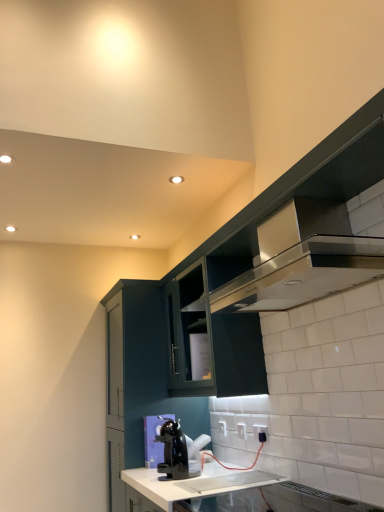
I want to click on matte dark green cabinet at center, positioned as the third cabinetry in right-to-left order, so click(132, 376).

The width and height of the screenshot is (384, 512). What do you see at coordinates (222, 428) in the screenshot?
I see `white plastic electric outlet at lower center, positioned as the third electric outlet in right-to-left order` at bounding box center [222, 428].

Describe the element at coordinates (260, 432) in the screenshot. The width and height of the screenshot is (384, 512). I see `white glossy electric outlet at lower center, the third electric outlet positioned from the back` at that location.

How much space does white glossy electric outlet at lower center, marked as the 1th electric outlet in a right-to-left arrangement, occupy horizontally?

A: The width of white glossy electric outlet at lower center, marked as the 1th electric outlet in a right-to-left arrangement, is 2.35 centimeters.

Measure the distance between white plastic electric outlet at lower center, which ranks as the 2th electric outlet in right-to-left order, and camera.

white plastic electric outlet at lower center, which ranks as the 2th electric outlet in right-to-left order, is 8.06 feet away from camera.

Describe the element at coordinates (212, 335) in the screenshot. Image resolution: width=384 pixels, height=512 pixels. I see `matte dark green cabinet at upper center, which ranks as the second cabinetry in right-to-left order` at that location.

At what (x,y) coordinates should I click in order to perform the action: click on satin silver exhaust hood at upper right. Please return your answer as a coordinate pair (x, y). Looking at the image, I should click on (302, 260).

Measure the distance between satin black cabinet at upper right, which is the third cabinetry in left-to-right order, and white plastic electric outlet at lower center, positioned as the 2th electric outlet in front-to-back order.

satin black cabinet at upper right, which is the third cabinetry in left-to-right order, is 3.75 feet from white plastic electric outlet at lower center, positioned as the 2th electric outlet in front-to-back order.

From the picture: Between satin black cabinet at upper right, which is the third cabinetry in left-to-right order, and white plastic electric outlet at lower center, which is the 2th electric outlet from back to front, which one appears on the right side from the viewer's perspective?

From the viewer's perspective, satin black cabinet at upper right, which is the third cabinetry in left-to-right order, appears more on the right side.

Which of these two, satin black cabinet at upper right, which is the third cabinetry in left-to-right order, or white plastic electric outlet at lower center, which is the 2th electric outlet from back to front, is wider?

satin black cabinet at upper right, which is the third cabinetry in left-to-right order, is wider.

Considering the sizes of objects satin black cabinet at upper right, arranged as the 1th cabinetry when viewed from the right, and white plastic electric outlet at lower center, positioned as the 2th electric outlet in front-to-back order, in the image provided, who is taller, satin black cabinet at upper right, arranged as the 1th cabinetry when viewed from the right, or white plastic electric outlet at lower center, positioned as the 2th electric outlet in front-to-back order,?

satin black cabinet at upper right, arranged as the 1th cabinetry when viewed from the right, is taller.

Is white plastic electric outlet at lower center, positioned as the third electric outlet in right-to-left order, at the right side of white glossy countertop at lower center?

Yes.

Could you measure the distance between white plastic electric outlet at lower center, which appears as the 1th electric outlet when viewed from the left, and white glossy countertop at lower center?

white plastic electric outlet at lower center, which appears as the 1th electric outlet when viewed from the left, and white glossy countertop at lower center are 23.91 inches apart from each other.

In the scene shown: Considering the relative sizes of white plastic electric outlet at lower center, the 3th electric outlet positioned from the front, and white glossy countertop at lower center in the image provided, is white plastic electric outlet at lower center, the 3th electric outlet positioned from the front, taller than white glossy countertop at lower center?

In fact, white plastic electric outlet at lower center, the 3th electric outlet positioned from the front, may be shorter than white glossy countertop at lower center.

Is white plastic electric outlet at lower center, positioned as the third electric outlet in right-to-left order, positioned with its back to white glossy countertop at lower center?

No.

From a real-world perspective, does black plastic coffee maker at lower center stand above white glossy countertop at lower center?

Indeed, from a real-world perspective, black plastic coffee maker at lower center stands above white glossy countertop at lower center.

Considering the sizes of objects black plastic coffee maker at lower center and white glossy countertop at lower center in the image provided, who is smaller, black plastic coffee maker at lower center or white glossy countertop at lower center?

With smaller size is black plastic coffee maker at lower center.

From the image's perspective, is black plastic coffee maker at lower center above or below white glossy countertop at lower center?

Clearly, from the image's perspective, black plastic coffee maker at lower center is above white glossy countertop at lower center.

Is black plastic coffee maker at lower center further to camera compared to white glossy countertop at lower center?

Yes, the depth of black plastic coffee maker at lower center is greater than that of white glossy countertop at lower center.

From the picture: Which of these two, satin silver exhaust hood at upper right or white glossy countertop at lower center, is wider?

white glossy countertop at lower center.

In terms of height, does satin silver exhaust hood at upper right look taller or shorter compared to white glossy countertop at lower center?

satin silver exhaust hood at upper right is taller than white glossy countertop at lower center.

From a real-world perspective, between satin silver exhaust hood at upper right and white glossy countertop at lower center, who is vertically lower?

In real-world perspective, white glossy countertop at lower center is lower.

Considering the relative sizes of white plastic electric outlet at lower center, positioned as the third electric outlet in right-to-left order, and white plastic electric outlet at lower center, positioned as the 2th electric outlet in front-to-back order, in the image provided, is white plastic electric outlet at lower center, positioned as the third electric outlet in right-to-left order, bigger than white plastic electric outlet at lower center, positioned as the 2th electric outlet in front-to-back order,?

Indeed, white plastic electric outlet at lower center, positioned as the third electric outlet in right-to-left order, has a larger size compared to white plastic electric outlet at lower center, positioned as the 2th electric outlet in front-to-back order.

Does white plastic electric outlet at lower center, the 1th electric outlet when ordered from back to front, touch white plastic electric outlet at lower center, positioned as the 2th electric outlet in front-to-back order?

No, white plastic electric outlet at lower center, the 1th electric outlet when ordered from back to front, is not next to white plastic electric outlet at lower center, positioned as the 2th electric outlet in front-to-back order.

Looking at this image, how much distance is there between white plastic electric outlet at lower center, the 3th electric outlet positioned from the front, and white plastic electric outlet at lower center, which is the 2th electric outlet from back to front?

white plastic electric outlet at lower center, the 3th electric outlet positioned from the front, is 8.31 inches from white plastic electric outlet at lower center, which is the 2th electric outlet from back to front.

Which object is further away from the camera, white plastic electric outlet at lower center, positioned as the third electric outlet in right-to-left order, or white plastic electric outlet at lower center, which is the second electric outlet in left-to-right order?

white plastic electric outlet at lower center, positioned as the third electric outlet in right-to-left order, is more distant.

Is satin black cabinet at upper right, which is the third cabinetry in left-to-right order, smaller than satin silver exhaust hood at upper right?

Indeed, satin black cabinet at upper right, which is the third cabinetry in left-to-right order, has a smaller size compared to satin silver exhaust hood at upper right.

Locate an element on the screen. The image size is (384, 512). the 2nd cabinetry below the satin silver exhaust hood at upper right (from the image's perspective) is located at coordinates (308, 165).

Could you measure the distance between satin black cabinet at upper right, arranged as the 1th cabinetry when viewed from the right, and satin silver exhaust hood at upper right?

satin black cabinet at upper right, arranged as the 1th cabinetry when viewed from the right, is 1.53 meters away from satin silver exhaust hood at upper right.

Is point (229, 234) farther from viewer compared to point (309, 248)?

Yes.

Could you tell me if satin silver exhaust hood at upper right is facing matte dark green cabinet at center, which is the first cabinetry from left to right?

No, satin silver exhaust hood at upper right is not facing towards matte dark green cabinet at center, which is the first cabinetry from left to right.

From the picture: Is satin silver exhaust hood at upper right touching matte dark green cabinet at center, which is the first cabinetry from left to right?

No, satin silver exhaust hood at upper right is not next to matte dark green cabinet at center, which is the first cabinetry from left to right.

From a real-world perspective, is satin silver exhaust hood at upper right on top of matte dark green cabinet at center, which is the first cabinetry from left to right?

Yes, from a real-world perspective, satin silver exhaust hood at upper right is over matte dark green cabinet at center, which is the first cabinetry from left to right

The image size is (384, 512). What are the coordinates of `the 3rd electric outlet below the satin black cabinet at upper right, arranged as the 1th cabinetry when viewed from the right (from a real-world perspective)` in the screenshot? It's located at (242, 430).

From a real-world perspective, which electric outlet is the 3rd one above the white glossy countertop at lower center? Please provide its 2D coordinates.

[(222, 428)]

Looking at the image, which one is located closer to white plastic electric outlet at lower center, which is the 2th electric outlet from back to front, white glossy countertop at lower center or matte dark green cabinet at upper center, the second cabinetry when ordered from left to right?

white glossy countertop at lower center is closer to white plastic electric outlet at lower center, which is the 2th electric outlet from back to front.

Looking at the image, which one is located further to white plastic electric outlet at lower center, which is the 2th electric outlet from back to front, matte dark green cabinet at upper center, the second cabinetry when ordered from left to right, or black plastic coffee maker at lower center?

matte dark green cabinet at upper center, the second cabinetry when ordered from left to right.

Which object lies nearer to the anchor point satin silver exhaust hood at upper right, matte dark green cabinet at center, which is the first cabinetry from left to right, or white plastic electric outlet at lower center, which appears as the 1th electric outlet when viewed from the left?

matte dark green cabinet at center, which is the first cabinetry from left to right, is positioned closer to the anchor satin silver exhaust hood at upper right.

When comparing their distances from matte dark green cabinet at upper center, which ranks as the second cabinetry in right-to-left order, does white plastic electric outlet at lower center, which is the 2th electric outlet from back to front, or satin black cabinet at upper right, which is the third cabinetry in left-to-right order, seem further?

satin black cabinet at upper right, which is the third cabinetry in left-to-right order, is further to matte dark green cabinet at upper center, which ranks as the second cabinetry in right-to-left order.

Looking at this image, from the image, which object appears to be farther from white glossy countertop at lower center, black plastic coffee maker at lower center or matte dark green cabinet at upper center, which ranks as the second cabinetry in right-to-left order?

Based on the image, matte dark green cabinet at upper center, which ranks as the second cabinetry in right-to-left order, appears to be further to white glossy countertop at lower center.

Based on their spatial positions, is satin silver exhaust hood at upper right or white plastic electric outlet at lower center, which is the second electric outlet in left-to-right order, closer to matte dark green cabinet at upper center, which ranks as the second cabinetry in right-to-left order?

Based on the image, satin silver exhaust hood at upper right appears to be nearer to matte dark green cabinet at upper center, which ranks as the second cabinetry in right-to-left order.

When comparing their distances from white plastic electric outlet at lower center, which is the 2th electric outlet from back to front, does white plastic electric outlet at lower center, which appears as the 1th electric outlet when viewed from the left, or white glossy electric outlet at lower center, the third electric outlet positioned from the left, seem further?

white plastic electric outlet at lower center, which appears as the 1th electric outlet when viewed from the left, is positioned further to the anchor white plastic electric outlet at lower center, which is the 2th electric outlet from back to front.

Based on their spatial positions, is black plastic coffee maker at lower center or white glossy countertop at lower center further from white glossy electric outlet at lower center, marked as the 1th electric outlet in a front-to-back arrangement?

white glossy countertop at lower center.

Locate an element on the screen. home appliance between satin silver exhaust hood at upper right and matte dark green cabinet at center, positioned as the third cabinetry in right-to-left order, in the front-back direction is located at coordinates (179, 452).

Where is `exhaust hood between satin black cabinet at upper right, which is the third cabinetry in left-to-right order, and black plastic coffee maker at lower center from front to back`? The width and height of the screenshot is (384, 512). exhaust hood between satin black cabinet at upper right, which is the third cabinetry in left-to-right order, and black plastic coffee maker at lower center from front to back is located at coordinates (302, 260).

The width and height of the screenshot is (384, 512). I want to click on home appliance that lies between satin silver exhaust hood at upper right and white glossy countertop at lower center from top to bottom, so click(x=179, y=452).

What are the coordinates of `home appliance positioned between satin silver exhaust hood at upper right and white plastic electric outlet at lower center, which is the second electric outlet in left-to-right order, from near to far` in the screenshot? It's located at (179, 452).